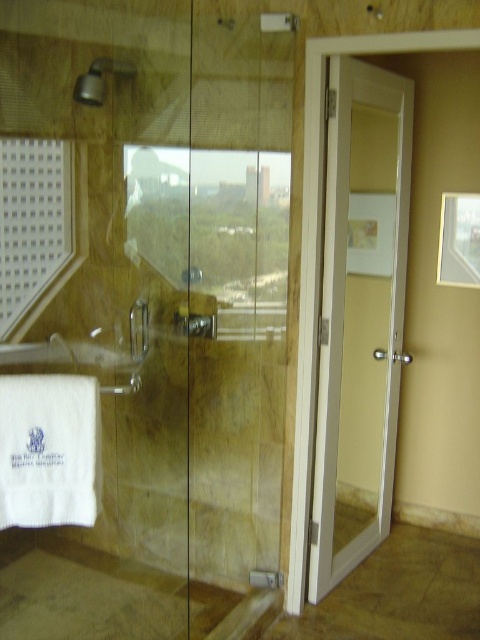
You are a guest in this bathroom and want to exit to the hallway. You see the white glossy door at right and the matte silver showerhead at upper left. Which object is closer to the hallway exit?

The white glossy door at right is positioned on the right side of the matte silver showerhead at upper left, so it is closer to the hallway exit.

You are a contractor measuring the bathroom for new fixtures. You need to install a new door that matches the existing white glossy door at right and a new showerhead that matches the matte silver showerhead at upper left. Which object has a greater width?

The white glossy door at right has a greater width than the matte silver showerhead at upper left, according to the description provided.

You are standing in the bathroom and want to exit through the door that leads to the hallway. According to the scene description, where is the white glossy door at right located in terms of coordinates?

The white glossy door at right is located at coordinates point [360,316].